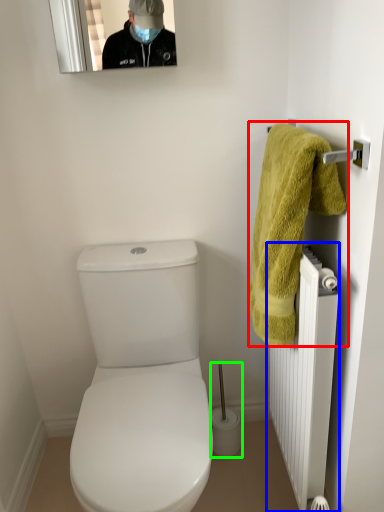
Question: Based on their relative distances, which object is nearer to towel (highlighted by a red box)? Choose from radiator (highlighted by a blue box) and brush (highlighted by a green box).

Choices:
 (A) radiator
 (B) brush

Answer: (A)